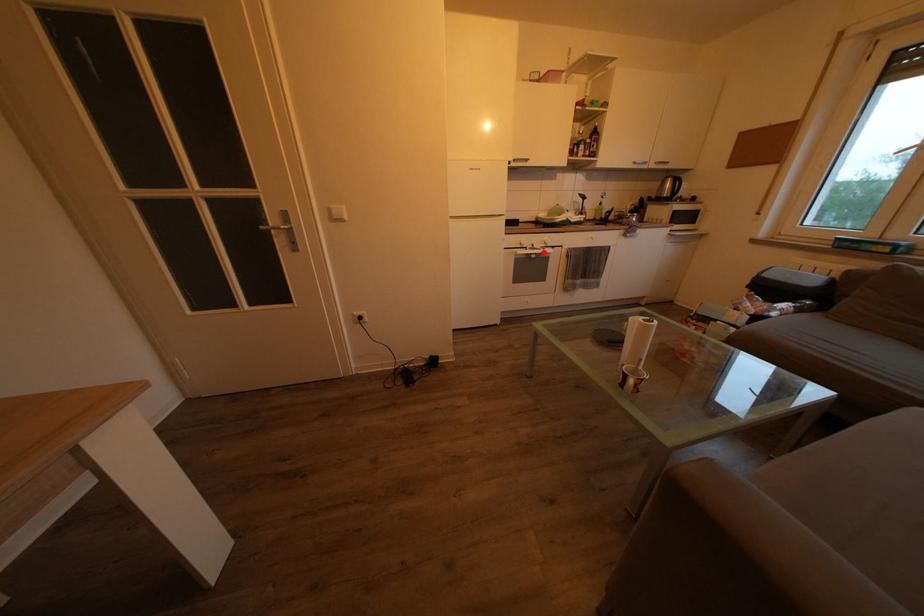
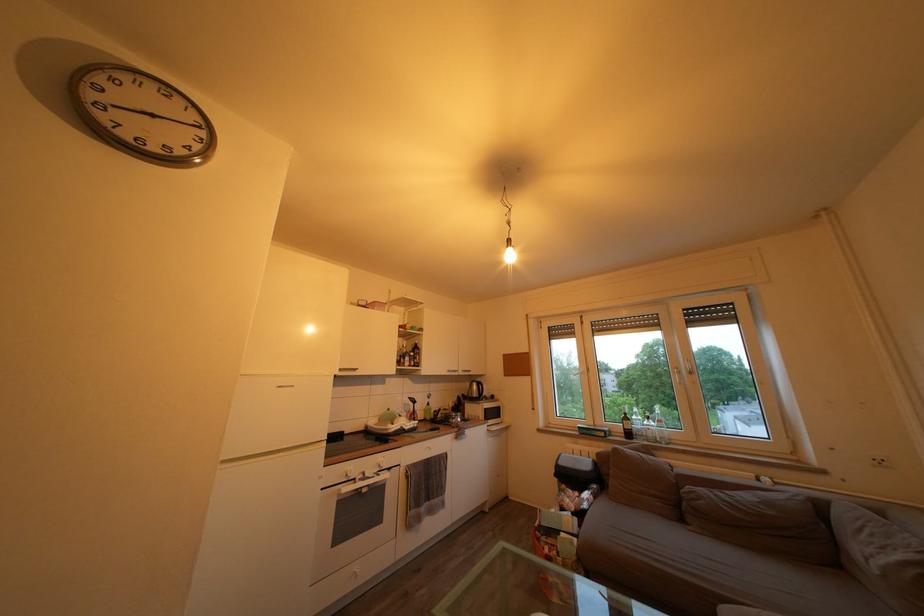
Where in the second image is the point corresponding to the highlighted location from the first image?

(375, 480)